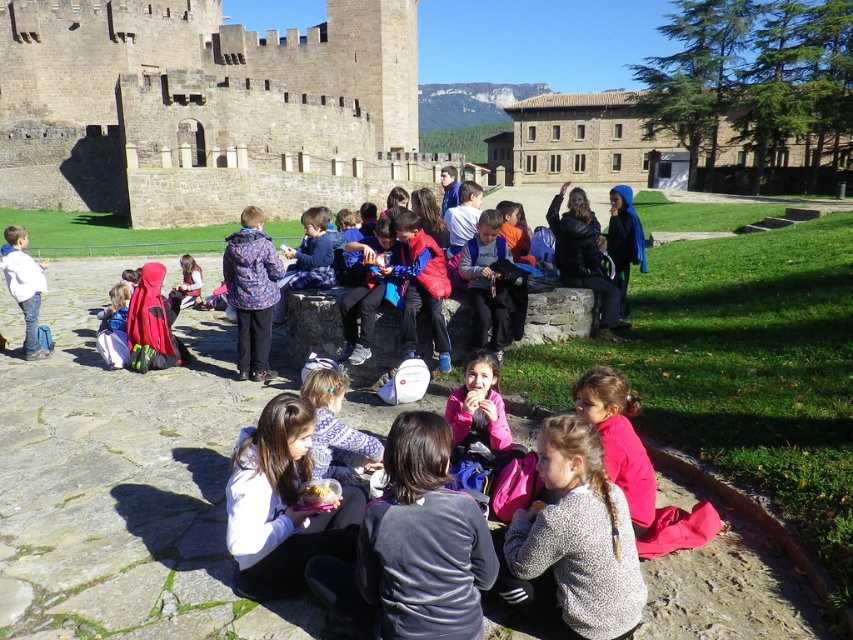
You are a photographer trying to capture a photo of the children in the courtyard. You notice the white fleece jacket at lower center and the white matte jacket at lower left. Which jacket should you focus on to ensure it appears taller in the photo?

The white matte jacket at lower left is taller than the white fleece jacket at lower center, so focusing on the white matte jacket at lower left will ensure it appears taller in the photo.